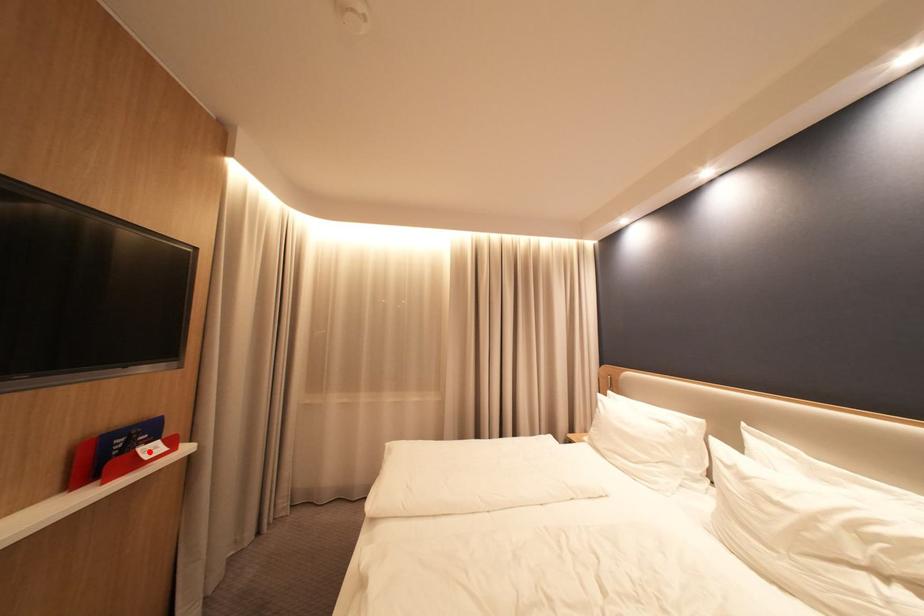
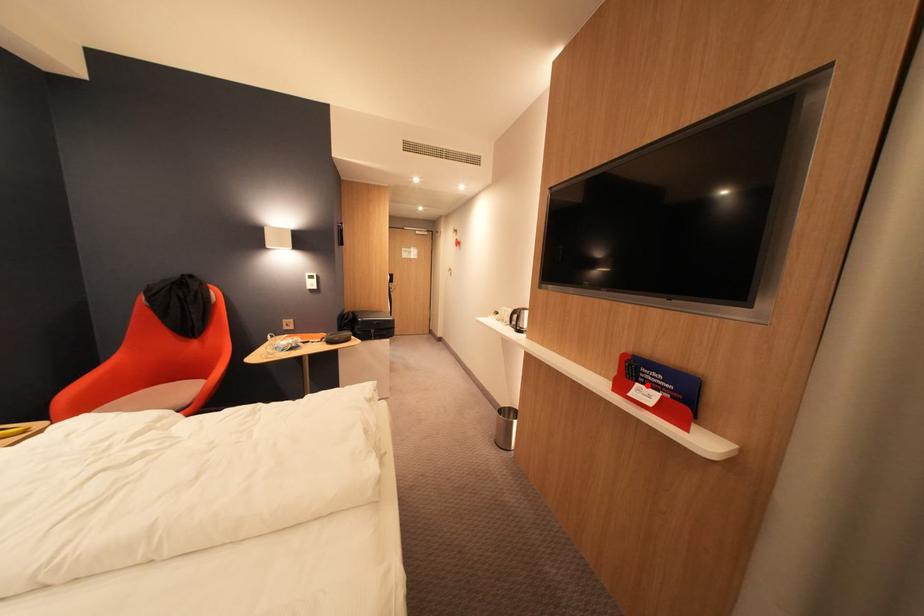
I am providing you with two images of the same scene from different viewpoints. A red point is marked on the first image and another point is marked on the second image. Is the marked point in image1 the same physical position as the marked point in image2?

Yes